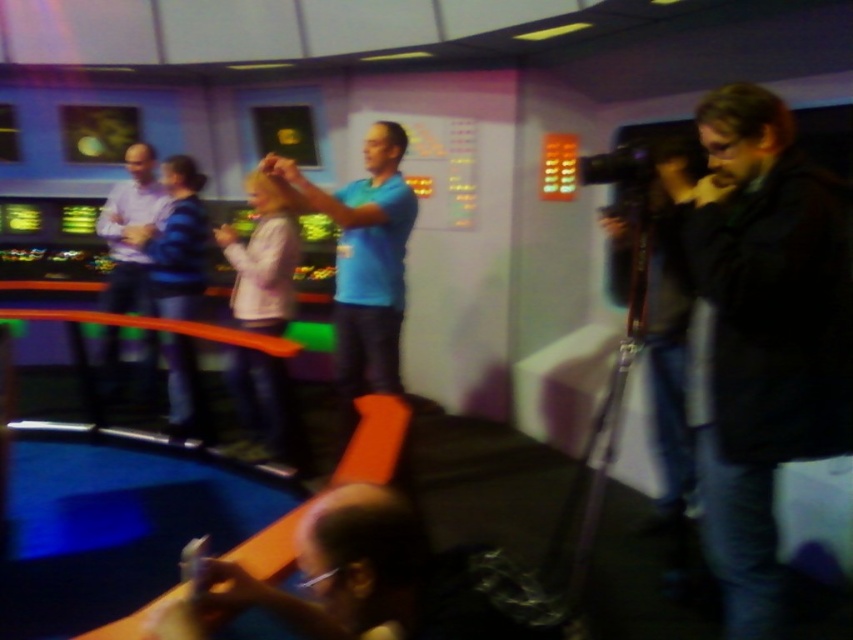
Question: Is blue striped sweater at center further to the viewer compared to light purple shirt at left?

Choices:
 (A) no
 (B) yes

Answer: (A)

Question: Is dark brown leather jacket at right wider than blue striped sweater at center?

Choices:
 (A) yes
 (B) no

Answer: (B)

Question: Which is farther from the blue matte shirt at center?

Choices:
 (A) dark brown leather jacket at right
 (B) blue striped sweater at center
 (C) light purple shirt at left

Answer: (C)

Question: Which object is farther from the camera taking this photo?

Choices:
 (A) dark brown leather jacket at right
 (B) blue matte shirt at center
 (C) blue striped sweater at center

Answer: (C)

Question: Which object is farther from the camera taking this photo?

Choices:
 (A) blue matte shirt at center
 (B) blue striped sweater at center
 (C) dark brown leather jacket at right
 (D) light purple shirt at left

Answer: (D)

Question: Does blue matte shirt at center appear on the left side of blue striped sweater at center?

Choices:
 (A) yes
 (B) no

Answer: (B)